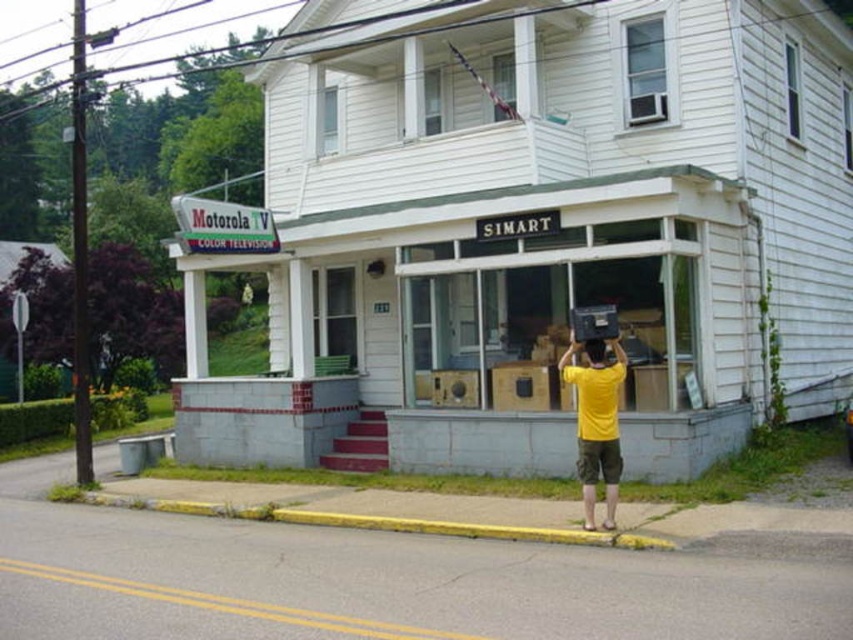
You are standing at the entrance of the building and want to locate the white wood storefront at center. According to the coordinates provided, in which direction should you move relative to your current position?

The white wood storefront at center is located at coordinates point (538, 230), so you should move towards the lower right direction from your current position at the entrance.

You are standing in front of the building and want to place a small potted plant between the yellow painted curb at lower center and the yellow matte shirt at center. Which object should the plant be closer to according to their positions?

The yellow painted curb at lower center is closer to the viewer than the yellow matte shirt at center, so the plant should be placed closer to the yellow matte shirt at center to be between them.